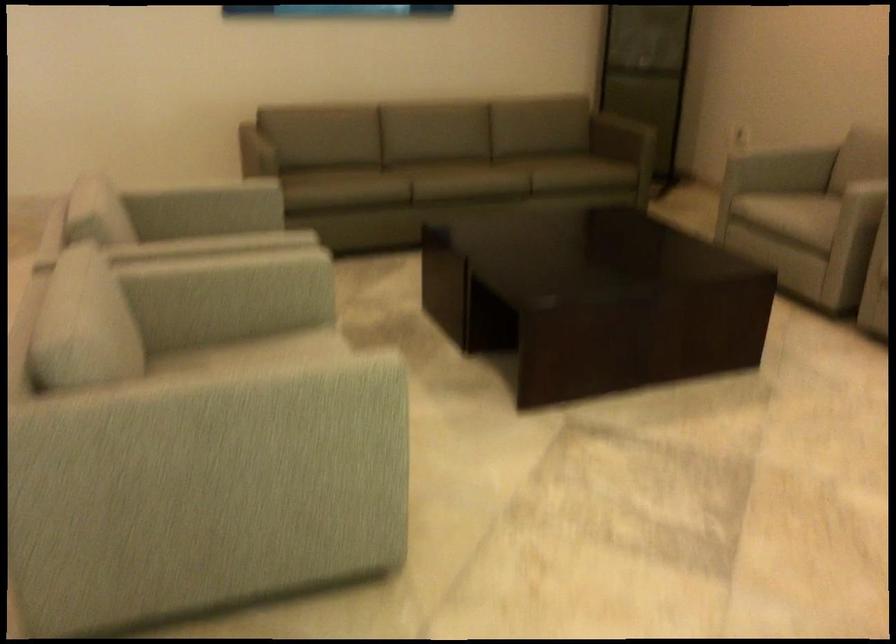
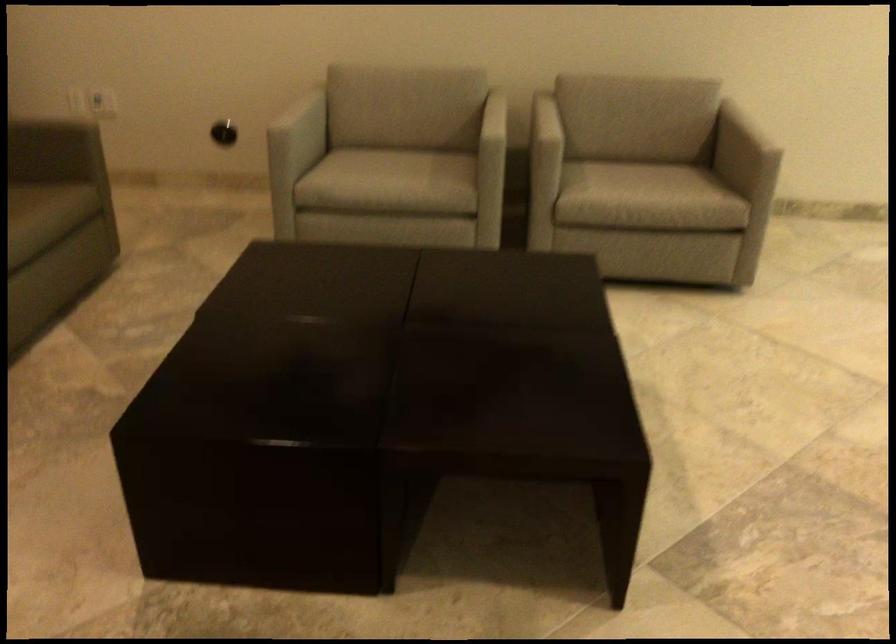
Find the pixel in the second image that matches point (782, 213) in the first image.

(390, 176)